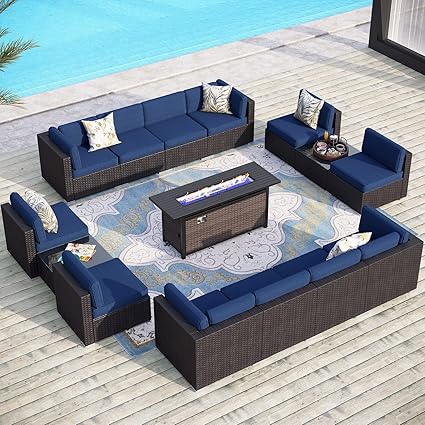
Locate an element on the screen. This screenshot has height=425, width=425. pillow is located at coordinates (40, 206), (96, 124), (217, 101), (305, 108), (343, 243).